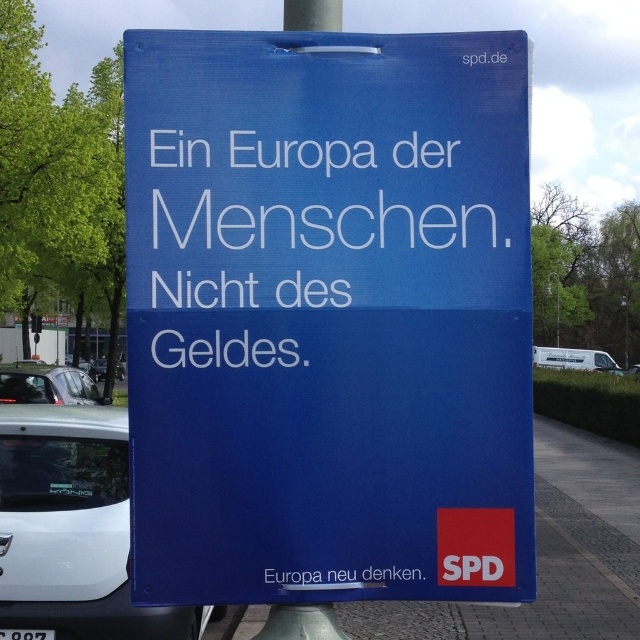
You are a pedestrian walking down the street and see the blue paper sign at center and the white text on blue sign at center. Which object is closer to you?

The blue paper sign at center is closer to you because it is in front of the white text on blue sign at center.

You are standing in a street where a parked car is visible on the left. You want to take a photo of the blue paper sign at center without the parked car appearing in the frame. Is the sign positioned in a way that allows this?

The blue paper sign at center is located at point coordinates (328, 312), which is centrally positioned. Since the parked car is only partially visible on the left, you can adjust your camera angle to focus on the center area where the sign is placed, thus excluding the parked car from the frame.

You are standing in the street looking at the large blue signboard. There are two points marked on the signboard at coordinates point [141,288] and point [368,570]. Which point is closer to you?

Point [141,288] is closer to the camera than point [368,570], so the point closer to you is point [141,288].